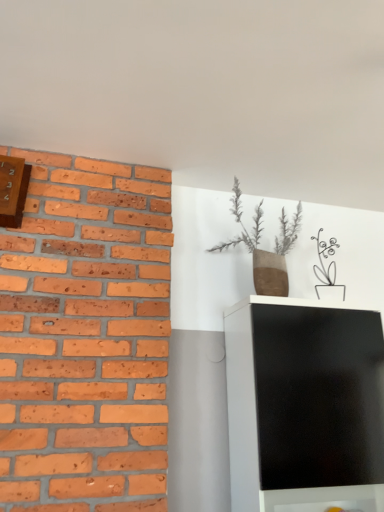
Question: Is brown textured vase at upper center in front of or behind wooden clock at upper left in the image?

Choices:
 (A) behind
 (B) front

Answer: (A)

Question: Looking at their shapes, would you say brown textured vase at upper center is wider or thinner than wooden clock at upper left?

Choices:
 (A) wide
 (B) thin

Answer: (A)

Question: From the image's perspective, is brown textured vase at upper center positioned above or below wooden clock at upper left?

Choices:
 (A) below
 (B) above

Answer: (A)

Question: Would you say wooden clock at upper left is to the left or to the right of brown textured vase at upper center in the picture?

Choices:
 (A) left
 (B) right

Answer: (A)

Question: Is wooden clock at upper left taller or shorter than brown textured vase at upper center?

Choices:
 (A) tall
 (B) short

Answer: (B)

Question: Does point (6, 173) appear closer or farther from the camera than point (256, 244)?

Choices:
 (A) farther
 (B) closer

Answer: (B)

Question: Is wooden clock at upper left inside the boundaries of brown textured vase at upper center, or outside?

Choices:
 (A) inside
 (B) outside

Answer: (B)